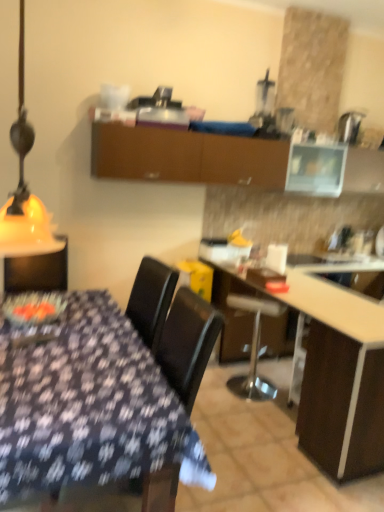
Question: Is white glossy countertop at center bigger than black matte chair at center?

Choices:
 (A) no
 (B) yes

Answer: (B)

Question: Is white glossy countertop at center smaller than black matte chair at center?

Choices:
 (A) no
 (B) yes

Answer: (A)

Question: Could you tell me if white glossy countertop at center is facing black matte chair at center?

Choices:
 (A) yes
 (B) no

Answer: (B)

Question: Is white glossy countertop at center not inside black matte chair at center?

Choices:
 (A) yes
 (B) no

Answer: (A)

Question: Is white glossy countertop at center to the right of black matte chair at center from the viewer's perspective?

Choices:
 (A) no
 (B) yes

Answer: (B)

Question: Is the depth of white glossy countertop at center less than that of black matte chair at center?

Choices:
 (A) yes
 (B) no

Answer: (B)

Question: Considering the relative positions of metallic silver bar stool at center and yellow matte lampshade at left in the image provided, is metallic silver bar stool at center behind yellow matte lampshade at left?

Choices:
 (A) yes
 (B) no

Answer: (A)

Question: From the image's perspective, does metallic silver bar stool at center appear lower than yellow matte lampshade at left?

Choices:
 (A) no
 (B) yes

Answer: (B)

Question: Would you say yellow matte lampshade at left is part of metallic silver bar stool at center's contents?

Choices:
 (A) no
 (B) yes

Answer: (A)

Question: Is metallic silver bar stool at center wider than yellow matte lampshade at left?

Choices:
 (A) no
 (B) yes

Answer: (B)

Question: Is metallic silver bar stool at center oriented away from yellow matte lampshade at left?

Choices:
 (A) no
 (B) yes

Answer: (A)

Question: Is metallic silver bar stool at center to the left of yellow matte lampshade at left from the viewer's perspective?

Choices:
 (A) yes
 (B) no

Answer: (B)

Question: Is yellow matte lampshade at left to the right of metallic silver bar stool at center from the viewer's perspective?

Choices:
 (A) no
 (B) yes

Answer: (A)